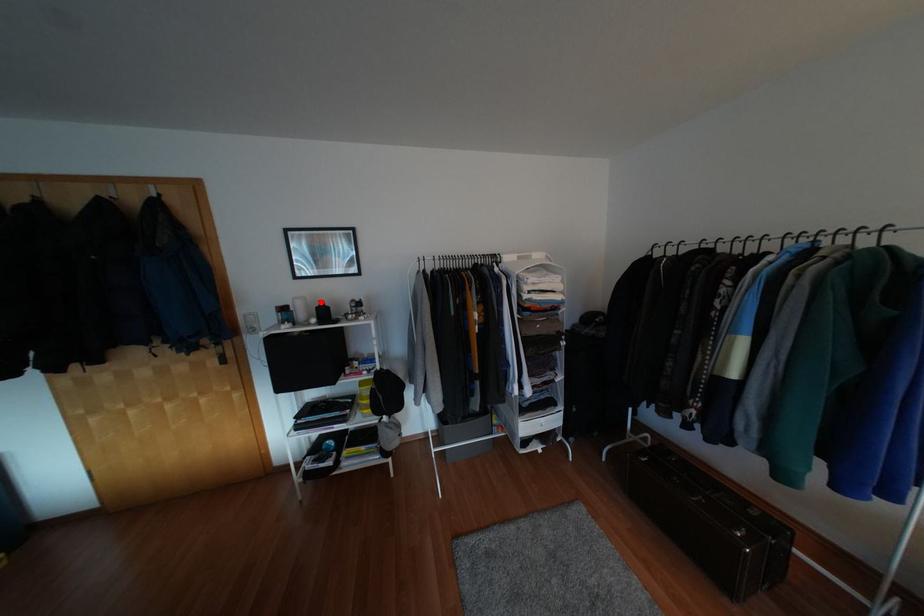
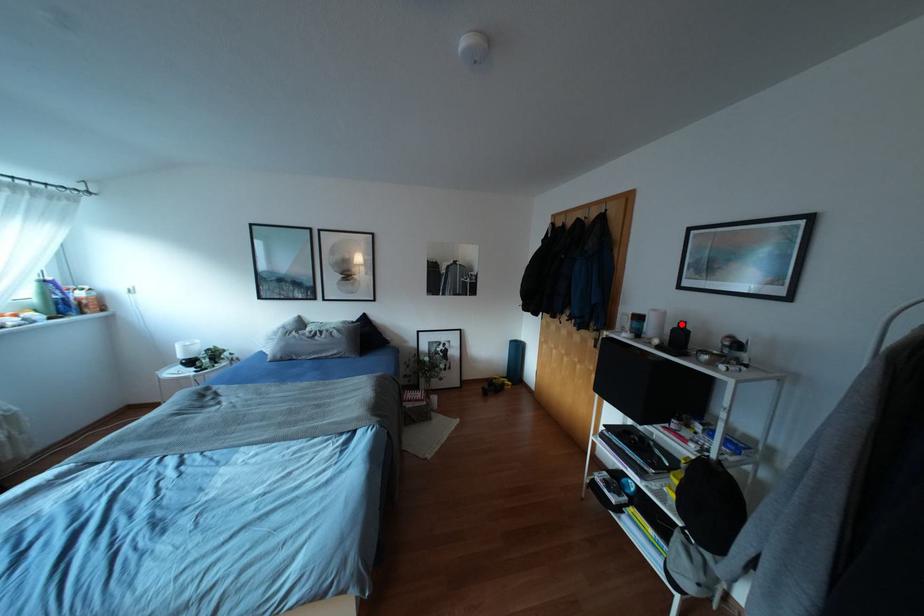
I am providing you with two images of the same scene from different viewpoints. A red point is marked on the first image and another point is marked on the second image. Does the point marked in image1 correspond to the same location as the one in image2?

Yes